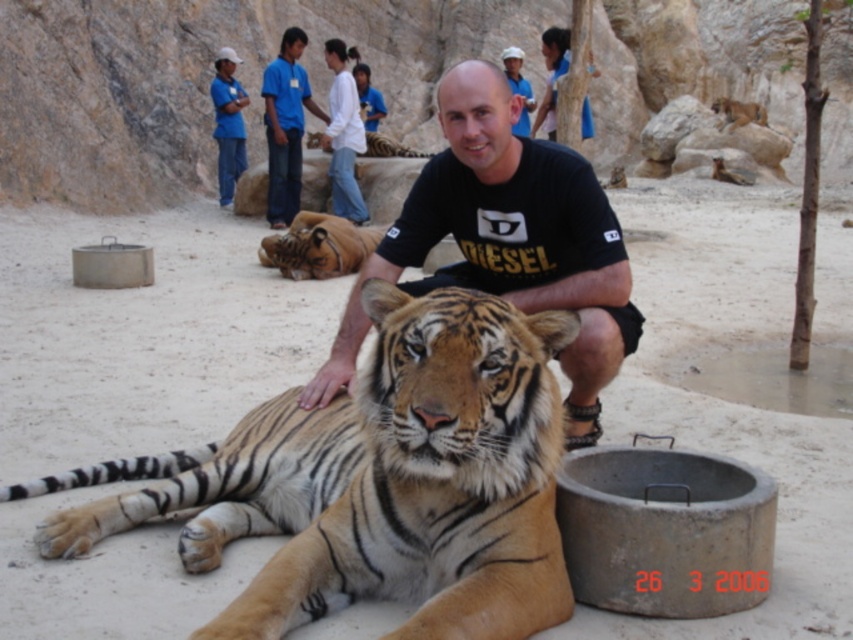
Find the location of `blue cotton shirt at upper center`. blue cotton shirt at upper center is located at coordinates pos(285,125).

Does black cotton t-shirt at center appear over blue shirt at upper center?

No.

The height and width of the screenshot is (640, 853). What do you see at coordinates (506, 241) in the screenshot?
I see `black cotton t-shirt at center` at bounding box center [506, 241].

Is point (344, 365) positioned after point (218, 108)?

No.

Identify the location of black cotton t-shirt at center. (506, 241).

Can you confirm if orange-brown fur tiger at center is bigger than blue shirt at upper center?

Yes.

Is orange-brown fur tiger at center wider than blue shirt at upper center?

Indeed, orange-brown fur tiger at center has a greater width compared to blue shirt at upper center.

Is point (144, 509) farther from viewer compared to point (229, 48)?

No, (144, 509) is in front of (229, 48).

What are the coordinates of `orange-brown fur tiger at center` in the screenshot? It's located at (375, 481).